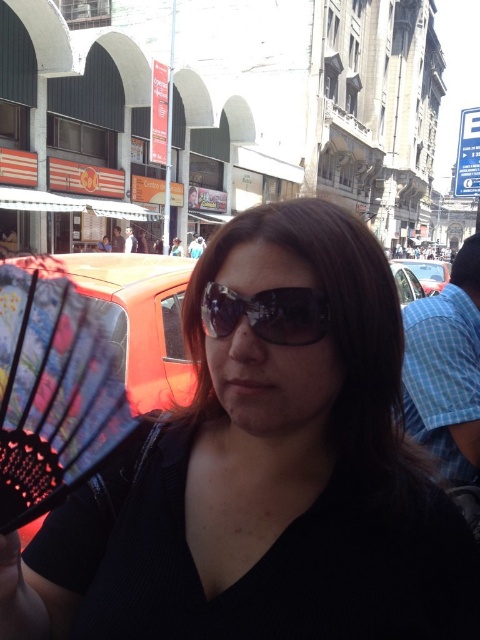
Question: Which object is closer to the camera taking this photo?

Choices:
 (A) black fabric fan at center
 (B) metallic silver car at right
 (C) black reflective sunglasses at center

Answer: (A)

Question: Is black reflective sunglasses at center smaller than metallic silver car at right?

Choices:
 (A) yes
 (B) no

Answer: (A)

Question: Which point is closer to the camera?

Choices:
 (A) metallic silver car at right
 (B) black reflective sunglasses at center
 (C) black fabric fan at center

Answer: (C)

Question: Which point is farther to the camera?

Choices:
 (A) black fabric fan at center
 (B) black reflective sunglasses at center

Answer: (B)

Question: Does black fabric fan at center have a greater width compared to black reflective sunglasses at center?

Choices:
 (A) yes
 (B) no

Answer: (A)

Question: Is black fabric fan at center wider than metallic silver car at right?

Choices:
 (A) no
 (B) yes

Answer: (A)